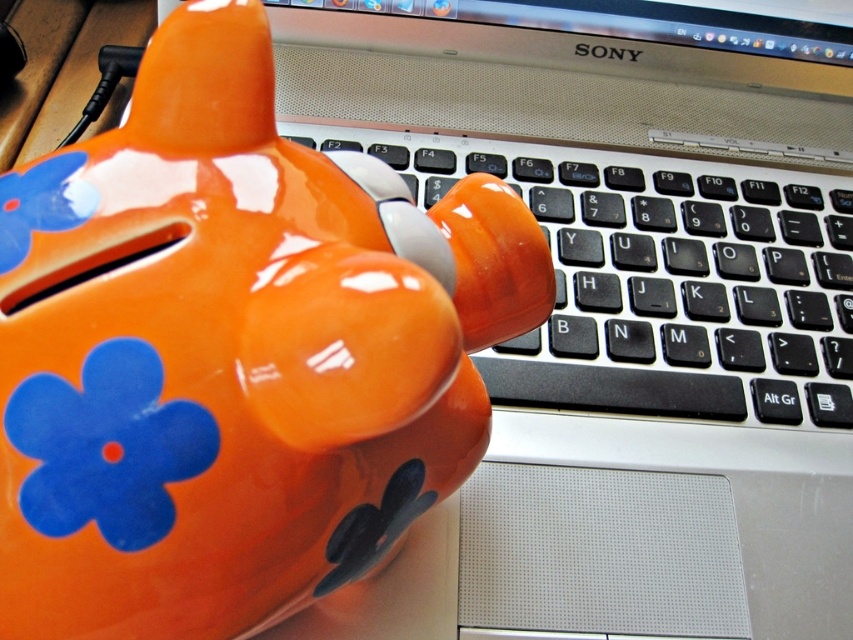
Who is shorter, glossy ceramic piggy bank at upper left or black plastic keyboard at center?

Standing shorter between the two is black plastic keyboard at center.

Who is positioned more to the left, glossy ceramic piggy bank at upper left or black plastic keyboard at center?

From the viewer's perspective, glossy ceramic piggy bank at upper left appears more on the left side.

Is point (169, 348) farther from camera compared to point (688, 237)?

No, (169, 348) is closer to viewer.

Find the location of `glossy ceramic piggy bank at upper left`. glossy ceramic piggy bank at upper left is located at coordinates 233,353.